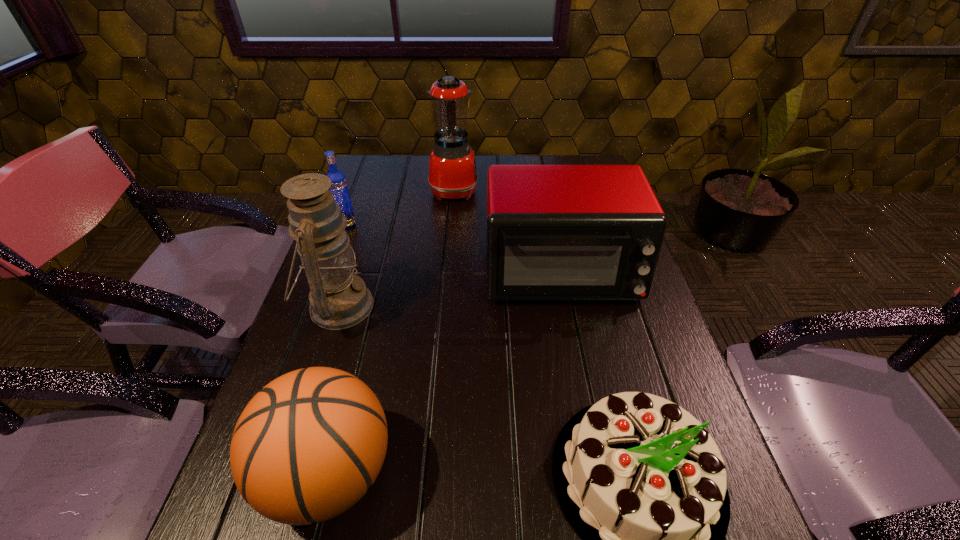
You are a GUI agent. You are given a task and a screenshot of the screen. Output one action in this format:
    pyautogui.click(x=<x>, y=<y>)
    Task: Click on the farthest object
    The height and width of the screenshot is (540, 960).
    Given the screenshot: What is the action you would take?
    pyautogui.click(x=453, y=174)

I want to click on oil lamp, so click(339, 299).

The height and width of the screenshot is (540, 960). I want to click on toaster oven, so click(554, 232).

Locate an element on the screen. vodka is located at coordinates (339, 188).

Find the location of a particular element. free space located on the controls of the farthest object is located at coordinates (556, 189).

The width and height of the screenshot is (960, 540). In order to click on vacant space located 0.330m on the back of the oil lamp in this screenshot , I will do `click(372, 202)`.

Identify the location of free spot located 0.340m on the front-facing side of the toaster oven. (596, 456).

At what (x,y) coordinates should I click in order to perform the action: click on vacant area situated on the front of the fifth nearest object. Please return your answer as a coordinate pair (x, y). This screenshot has height=540, width=960. Looking at the image, I should click on (311, 319).

I want to click on object present at the far edge, so click(453, 174).

At what (x,y) coordinates should I click in order to perform the action: click on oil lamp present at the left edge. Please return your answer as a coordinate pair (x, y). The height and width of the screenshot is (540, 960). Looking at the image, I should click on pyautogui.click(x=339, y=299).